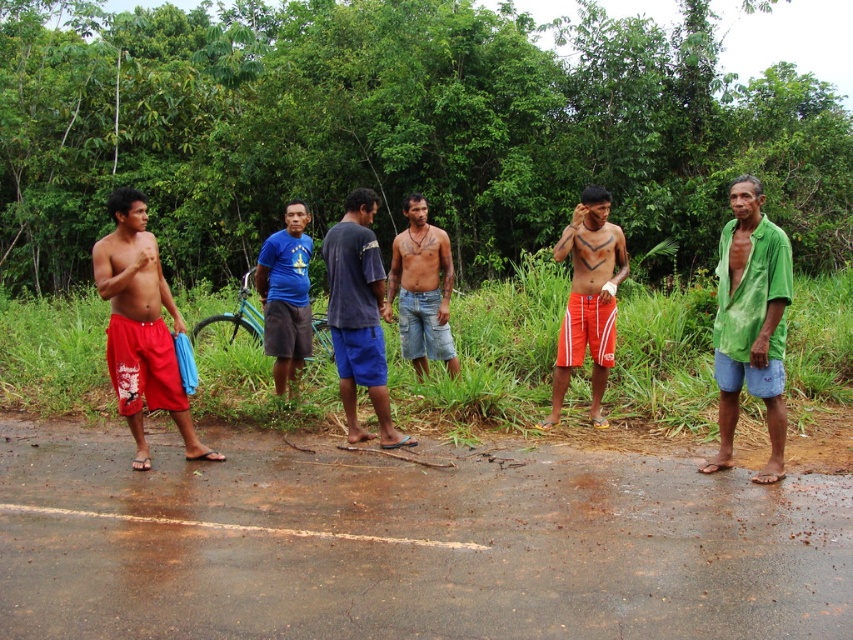
You are a photographer trying to capture a group photo of the six people in the scene. You need to position yourself between the red cotton shorts at left and the dark blue cotton shirt at center to ensure everyone is in frame. Is the space between them sufficient for you to stand comfortably?

The distance between the red cotton shorts at left and the dark blue cotton shirt at center is 1.30 meters. Since an average person requires about 0.6 meters of space to stand, the 1.30 meters provides enough room for you to position yourself comfortably between them.

You are a photographer trying to capture the scene. You notice the dark blue cotton shirt at center and the blue denim shorts at center. Which one is positioned lower in the image?

The dark blue cotton shirt at center is located below the blue denim shorts at center, so the dark blue cotton shirt at center is positioned lower in the image.

You are standing at the origin point of the coordinate system. Which direction should you move to reach the red cotton shorts at left?

The red cotton shorts at left is located at point (141, 326), so you should move to the right and slightly forward to reach it.